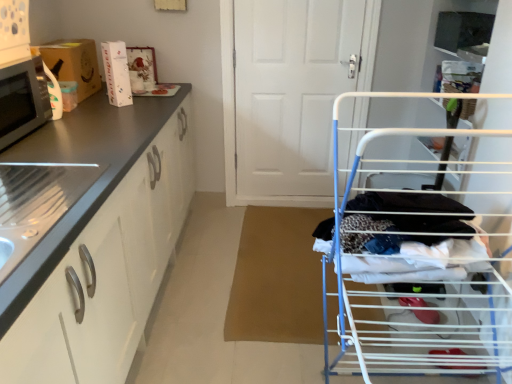
Question: Is matte cardboard box at left shorter than matte black microwave at left?

Choices:
 (A) yes
 (B) no

Answer: (B)

Question: From the image's perspective, is matte cardboard box at left located beneath matte black microwave at left?

Choices:
 (A) no
 (B) yes

Answer: (A)

Question: Is matte black microwave at left surrounded by matte cardboard box at left?

Choices:
 (A) no
 (B) yes

Answer: (A)

Question: Is matte cardboard box at left not near matte black microwave at left?

Choices:
 (A) no
 (B) yes

Answer: (A)

Question: From the image's perspective, does matte cardboard box at left appear higher than matte black microwave at left?

Choices:
 (A) yes
 (B) no

Answer: (A)

Question: Is matte cardboard box at left aimed at matte black microwave at left?

Choices:
 (A) yes
 (B) no

Answer: (B)

Question: Is white wire drying rack at right located outside white matte door at center?

Choices:
 (A) yes
 (B) no

Answer: (A)

Question: Is white wire drying rack at right smaller than white matte door at center?

Choices:
 (A) no
 (B) yes

Answer: (A)

Question: From the image's perspective, is white wire drying rack at right over white matte door at center?

Choices:
 (A) yes
 (B) no

Answer: (B)

Question: Does white wire drying rack at right have a larger size compared to white matte door at center?

Choices:
 (A) no
 (B) yes

Answer: (B)

Question: Is white wire drying rack at right oriented away from white matte door at center?

Choices:
 (A) yes
 (B) no

Answer: (B)

Question: Is white wire drying rack at right next to white matte door at center and touching it?

Choices:
 (A) yes
 (B) no

Answer: (B)

Question: From the image's perspective, is brushed metal drawer at left beneath white glossy cabinet at left?

Choices:
 (A) no
 (B) yes

Answer: (A)